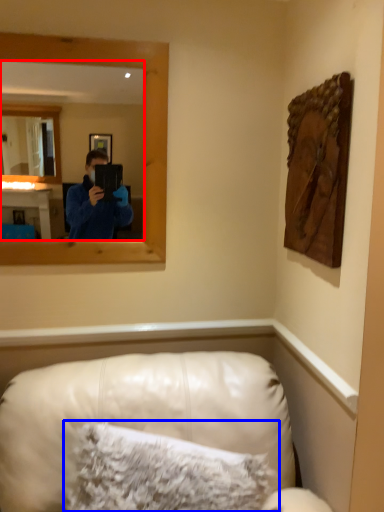
Question: Which point is closer to the camera, mirror (highlighted by a red box) or pillow (highlighted by a blue box)?

Choices:
 (A) mirror
 (B) pillow

Answer: (B)